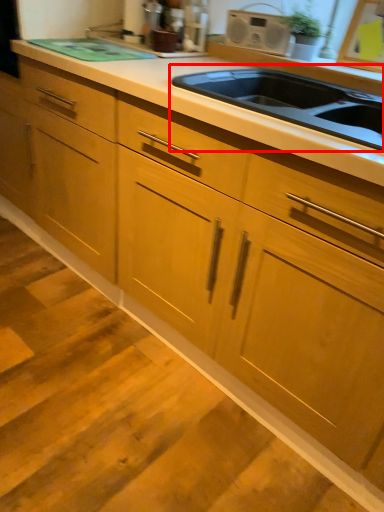
Question: From the image's perspective, what is the correct spatial relationship of sink (annotated by the red box) in relation to appliance?

Choices:
 (A) below
 (B) above

Answer: (A)